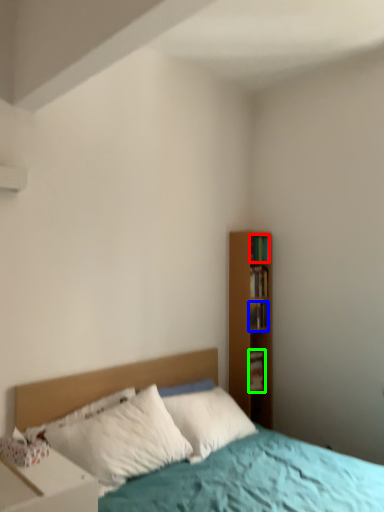
Question: Based on their relative distances, which object is farther from book (highlighted by a red box)? Choose from book (highlighted by a blue box) and book (highlighted by a green box).

Choices:
 (A) book
 (B) book

Answer: (B)